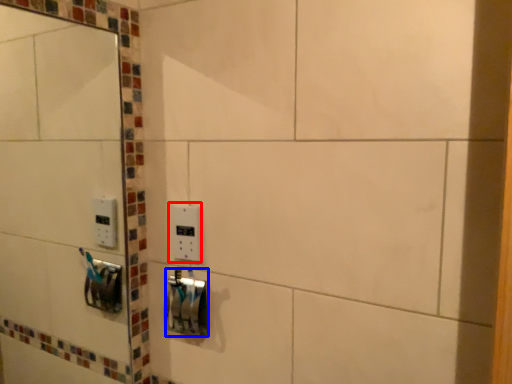
Question: Which point is closer to the camera, light switch (highlighted by a red box) or lock (highlighted by a blue box)?

Choices:
 (A) light switch
 (B) lock

Answer: (B)